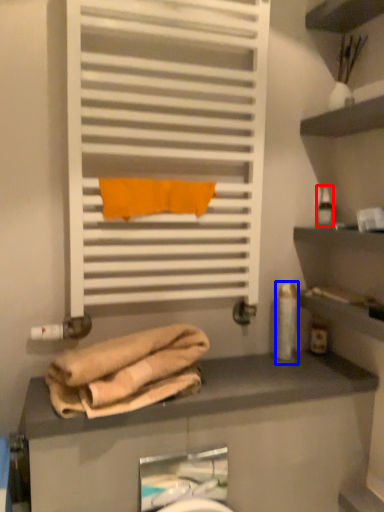
Question: Which point is closer to the camera, toiletry (highlighted by a red box) or toiletry (highlighted by a blue box)?

Choices:
 (A) toiletry
 (B) toiletry

Answer: (B)